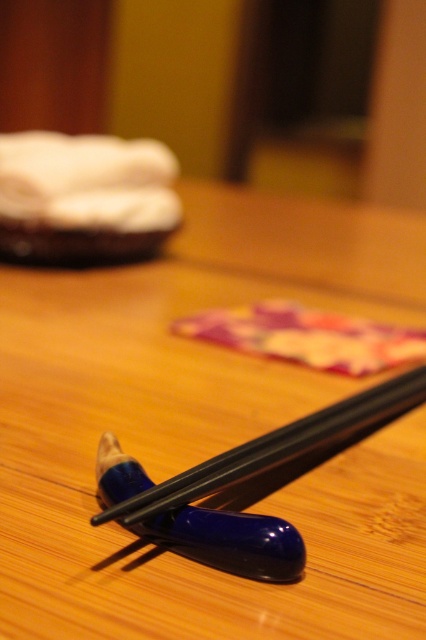
You are trying to reach for the black glossy chopsticks at center and the floral fabric at center. Which object will your hand touch first?

The black glossy chopsticks at center will be touched first because they are closer to the viewer than the floral fabric at center.

You are setting up a table for a formal dinner and need to choose between the black glossy chopsticks at center and the blue glossy chopsticks at center. Based on their height, which pair would be more suitable for serving soup?

The black glossy chopsticks at center is much taller than the blue glossy chopsticks at center, so the black glossy chopsticks at center would be more suitable for serving soup as they provide better reach into deeper bowls.

You are looking at the image of the chopsticks and need to determine which of the two points, point (x=414, y=333) or point (x=337, y=438), is closer to you. Based on the scene description, which point is nearer?

Point (x=414, y=333) is further to the camera than point (x=337, y=438). Wait, the question asks which is closer to you. Since point (x=414, y=333) is further to the camera, that means it is farther away from the viewer. Therefore, point (x=337, y=438) is closer to you.